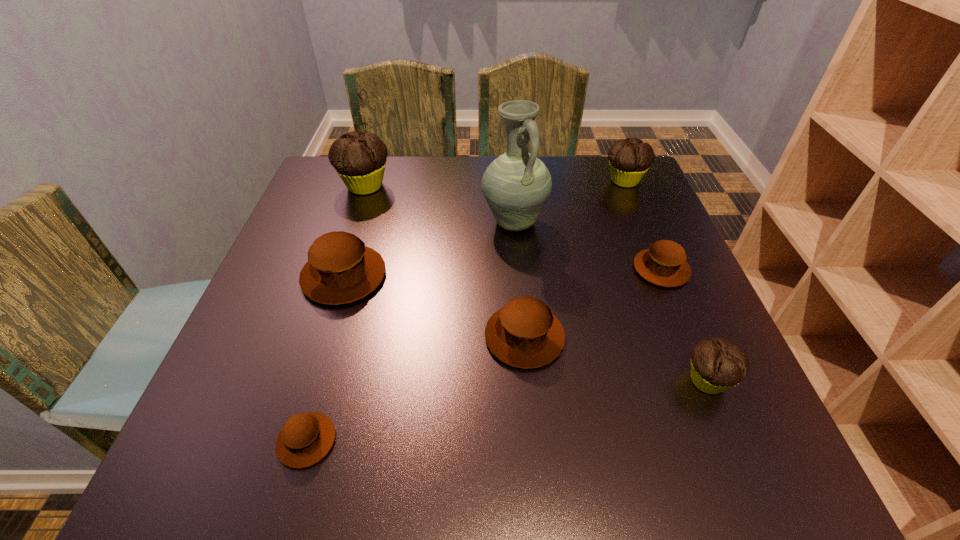
The image size is (960, 540). In order to click on pitcher in this screenshot , I will do `click(516, 185)`.

Find the location of a particular element. the tallest muffin is located at coordinates (359, 159).

Where is `the biggest chocolate muffin`? This screenshot has height=540, width=960. the biggest chocolate muffin is located at coordinates (359, 159).

The image size is (960, 540). Identify the location of the second smallest chocolate muffin. coord(629,159).

Find the location of a particular element. the biggest brown muffin is located at coordinates (340, 269).

Find the location of `the third brown muffin from left to right`. the third brown muffin from left to right is located at coordinates (524, 333).

I want to click on the fourth muffin from right to left, so click(x=524, y=333).

I want to click on the smallest chocolate muffin, so click(x=717, y=364).

Identify the location of the second smallest brown muffin. This screenshot has width=960, height=540. (664, 263).

Locate an element on the screen. the second shortest object is located at coordinates (664, 263).